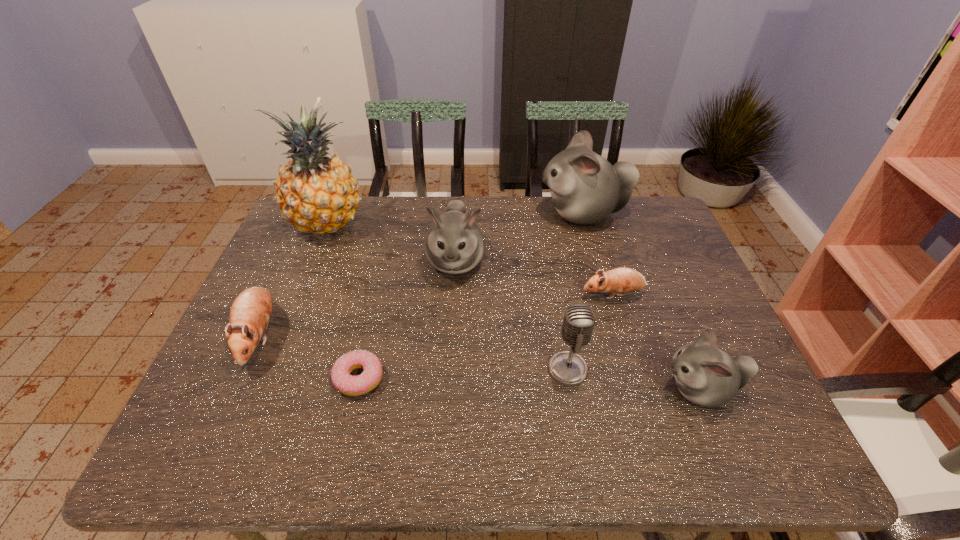
The height and width of the screenshot is (540, 960). Find the location of `pineapple located at the left edge`. pineapple located at the left edge is located at coordinates (316, 192).

Locate an element on the screen. This screenshot has width=960, height=540. hamster that is positioned at the left edge is located at coordinates (250, 313).

Locate an element on the screen. The image size is (960, 540). object that is at the far left corner is located at coordinates (316, 192).

The height and width of the screenshot is (540, 960). Find the location of `object positioned at the far right corner`. object positioned at the far right corner is located at coordinates (585, 188).

Image resolution: width=960 pixels, height=540 pixels. I want to click on free space at the far edge of the desktop, so click(x=577, y=235).

Identify the location of free space at the near edge of the desktop. (611, 437).

Find the location of a particular element. The image size is (960, 540). vacant space at the left edge of the desktop is located at coordinates (217, 363).

This screenshot has width=960, height=540. Identify the location of vacant region at the right edge of the desktop. (697, 407).

What are the coordinates of `vacant space at the near left corner of the desktop` in the screenshot? It's located at (226, 432).

Locate an element on the screen. This screenshot has height=540, width=960. free space between the fourth hamster from right to left and the smaller brown hamster is located at coordinates (535, 278).